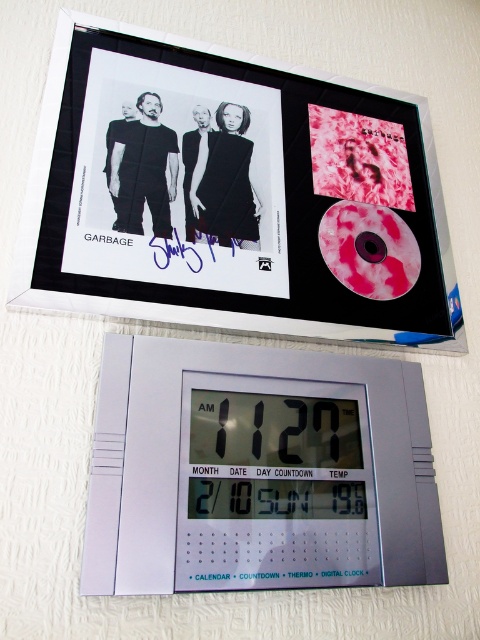
Question: Considering the relative positions of matte black album cover at upper center and silver plastic digital clock at upper center in the image provided, where is matte black album cover at upper center located with respect to silver plastic digital clock at upper center?

Choices:
 (A) left
 (B) right

Answer: (A)

Question: Which of the following is the closest to the observer?

Choices:
 (A) (146, 416)
 (B) (420, 100)

Answer: (A)

Question: Which of the following is the farthest from the observer?

Choices:
 (A) matte black album cover at upper center
 (B) silver plastic digital clock at upper center

Answer: (A)

Question: Is matte black album cover at upper center to the left of silver plastic digital clock at upper center from the viewer's perspective?

Choices:
 (A) no
 (B) yes

Answer: (B)

Question: Observing the image, what is the correct spatial positioning of matte black album cover at upper center in reference to silver plastic digital clock at upper center?

Choices:
 (A) above
 (B) below

Answer: (A)

Question: Which point is closer to the camera?

Choices:
 (A) tap(367, 506)
 (B) tap(133, 61)

Answer: (A)